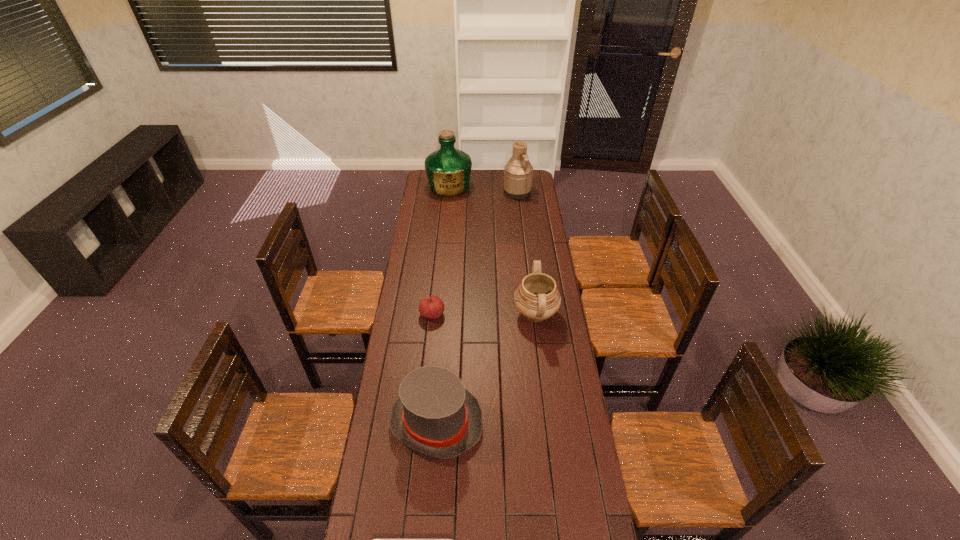
The height and width of the screenshot is (540, 960). Identify the location of free spot located 0.310m on the back of the second nearest object. (444, 325).

Identify the location of blank space located on the front of the second shortest object. The height and width of the screenshot is (540, 960). (427, 363).

Image resolution: width=960 pixels, height=540 pixels. Identify the location of liquor positioned at the far edge. (448, 169).

I want to click on pitcher positioned at the far edge, so click(x=518, y=173).

Locate an element on the screen. The height and width of the screenshot is (540, 960). liquor present at the left edge is located at coordinates (448, 169).

Where is `dress hat positioned at the left edge`? dress hat positioned at the left edge is located at coordinates (434, 414).

The image size is (960, 540). I want to click on tomato situated at the left edge, so click(431, 307).

The height and width of the screenshot is (540, 960). I want to click on pitcher that is at the right edge, so click(x=518, y=173).

Locate an element on the screen. The height and width of the screenshot is (540, 960). urn present at the right edge is located at coordinates (537, 298).

The image size is (960, 540). Identify the location of object that is positioned at the far left corner. (448, 169).